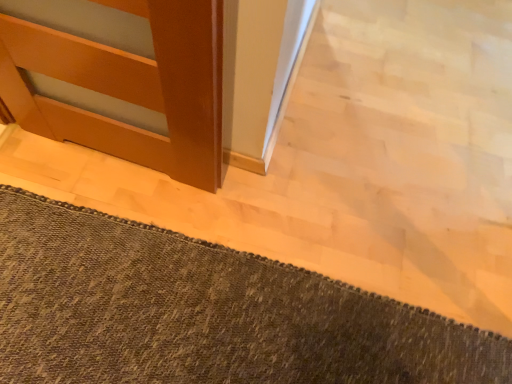
Question: From the image's perspective, is brown woven rug at lower left above or below matte wood door at left?

Choices:
 (A) below
 (B) above

Answer: (A)

Question: Is point (33, 195) positioned closer to the camera than point (204, 66)?

Choices:
 (A) farther
 (B) closer

Answer: (A)

Question: In the image, is brown woven rug at lower left positioned in front of or behind matte wood door at left?

Choices:
 (A) behind
 (B) front

Answer: (A)

Question: Is point (17, 71) positioned closer to the camera than point (326, 342)?

Choices:
 (A) closer
 (B) farther

Answer: (B)

Question: Is matte wood door at left inside or outside of brown woven rug at lower left?

Choices:
 (A) inside
 (B) outside

Answer: (B)

Question: In terms of width, does matte wood door at left look wider or thinner when compared to brown woven rug at lower left?

Choices:
 (A) thin
 (B) wide

Answer: (A)

Question: In terms of height, does matte wood door at left look taller or shorter compared to brown woven rug at lower left?

Choices:
 (A) short
 (B) tall

Answer: (B)